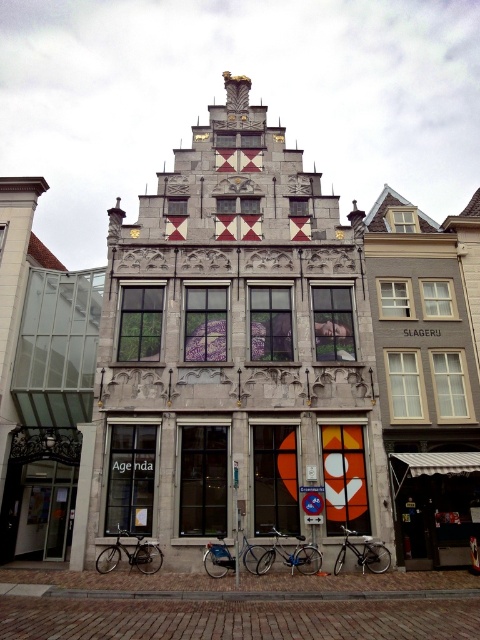
You are standing in front of the historic building. You notice two points marked on the facade. The first point is at coordinates point (156, 547) and the second is at point (294, 548). Which point is closer to you?

Point (156, 547) is closer to the viewer than point (294, 548).

You are a delivery person trying to park your shiny metallic bicycle at center near the silver metallic bicycle at lower left. Is there enough space between them to fit another small bicycle?

The silver metallic bicycle at lower left occupies less space than the shiny metallic bicycle at center, so there might be enough space between them to fit another small bicycle depending on their positioning.

In the scene shown: You are standing in front of the historic building and see two bicycles. The silver metallic bicycle at lower left and the shiny metallic bicycle at center. Which bicycle is located more to the left?

The silver metallic bicycle at lower left is more to the left than the shiny metallic bicycle at center.